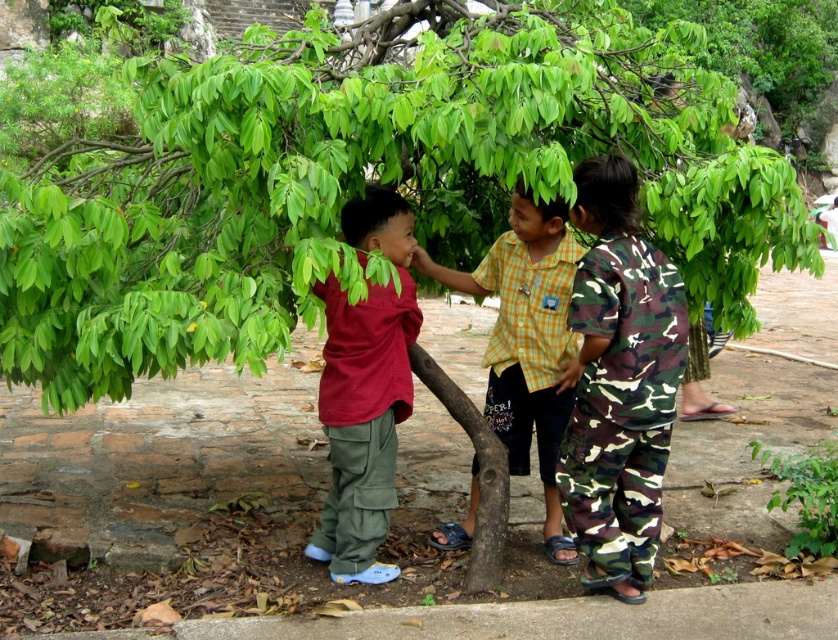
You are a photographer trying to capture a photo of the camouflage pants at right without including the green leafy tree at center in the background. Is this possible based on their positions?

The green leafy tree at center is in front of camouflage pants at right, so the tree would block the view of the camouflage pants at right. Therefore, it is not possible to take a photo of the camouflage pants at right without the tree appearing in the background.